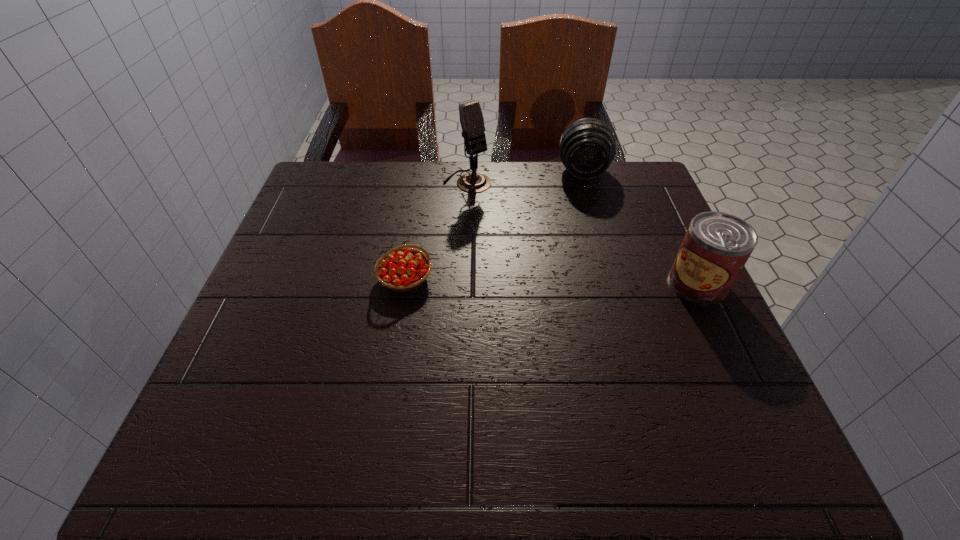
In order to click on vacant area situated on the front-facing side of the tallest object in this screenshot , I will do `click(581, 283)`.

Identify the location of free point located at the front element of the third object from left to right. The height and width of the screenshot is (540, 960). (584, 214).

Image resolution: width=960 pixels, height=540 pixels. In order to click on vacant space situated at the front element of the third object from left to right in this screenshot , I will do `click(585, 252)`.

You are a GUI agent. You are given a task and a screenshot of the screen. Output one action in this format:
    pyautogui.click(x=<x>, y=<y>)
    Task: Click on the vacant space located 0.150m at the front element of the third object from left to right
    The height and width of the screenshot is (540, 960).
    Given the screenshot: What is the action you would take?
    pyautogui.click(x=585, y=221)

This screenshot has width=960, height=540. I want to click on microphone at the far edge, so click(x=471, y=118).

Identify the location of telephoto lens present at the far edge. (587, 147).

You are a GUI agent. You are given a task and a screenshot of the screen. Output one action in this format:
    pyautogui.click(x=<x>, y=<y>)
    Task: Click on the can located at the right edge
    
    Given the screenshot: What is the action you would take?
    pos(717,245)

The image size is (960, 540). What are the coordinates of `telephoto lens at the right edge` in the screenshot? It's located at (587, 147).

At what (x,y) coordinates should I click in order to perform the action: click on object at the far right corner. Please return your answer as a coordinate pair (x, y). The width and height of the screenshot is (960, 540). Looking at the image, I should click on (587, 147).

Identify the location of vacant space at the far edge of the desktop. This screenshot has height=540, width=960. (425, 184).